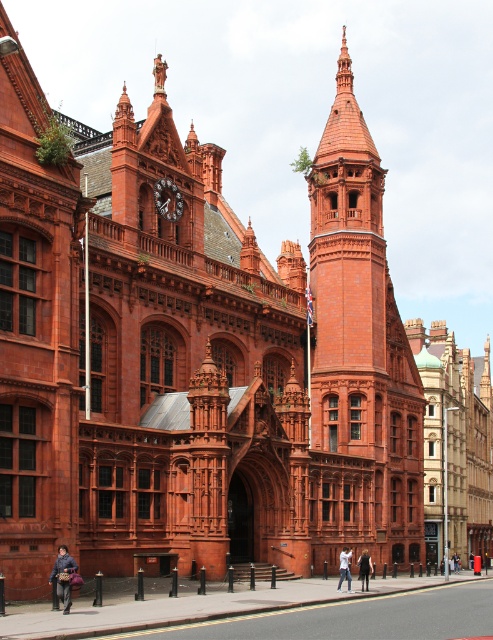
Which is below, metallic clock face at upper center or leather jacket at lower left?

leather jacket at lower left is lower down.

Between metallic clock face at upper center and leather jacket at lower left, which one has more height?

Standing taller between the two is metallic clock face at upper center.

Does point (164, 196) come behind point (70, 595)?

Yes, point (164, 196) is farther from viewer.

At what (x,y) coordinates should I click in order to perform the action: click on metallic clock face at upper center. Please return your answer as a coordinate pair (x, y). Image resolution: width=493 pixels, height=640 pixels. Looking at the image, I should click on (168, 198).

Which is more to the right, matte brick tower at center or white cotton shirt at center?

Positioned to the right is matte brick tower at center.

Which is behind, point (349, 227) or point (341, 561)?

Point (349, 227)

Does point (328, 161) come in front of point (349, 589)?

No, it is not.

The image size is (493, 640). Find the location of `matte brick tower at center`. matte brick tower at center is located at coordinates (358, 355).

Who is higher up, white cotton shirt at center or dark gray fabric coat at center?

Positioned higher is white cotton shirt at center.

Who is positioned more to the left, white cotton shirt at center or dark gray fabric coat at center?

white cotton shirt at center

Who is more forward, (346, 560) or (366, 561)?

Positioned in front is point (346, 560).

The height and width of the screenshot is (640, 493). Find the location of `white cotton shirt at center`. white cotton shirt at center is located at coordinates (345, 566).